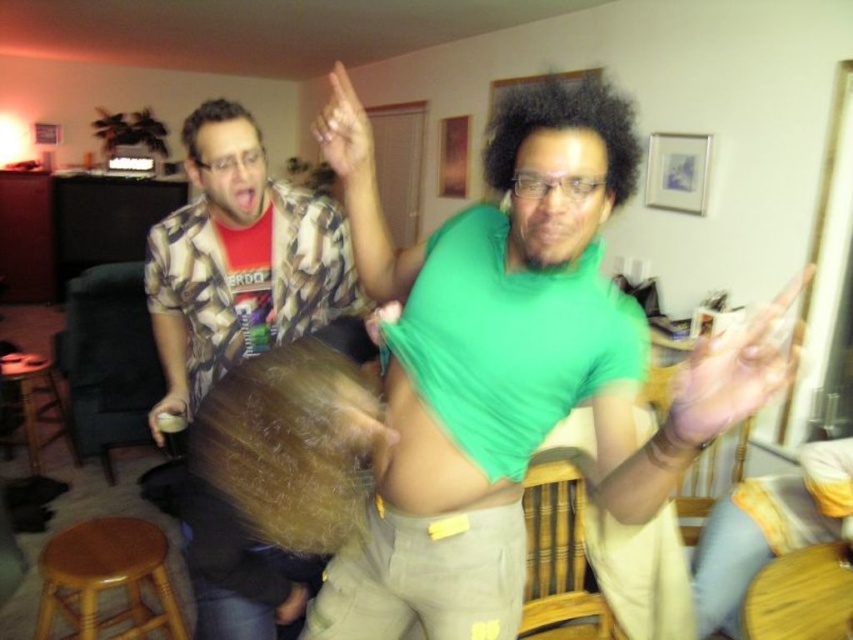
Does green matte shirt at center lie in front of wooden bar stool at lower left?

Yes, green matte shirt at center is in front of wooden bar stool at lower left.

Can you confirm if green matte shirt at center is thinner than wooden bar stool at lower left?

Correct, green matte shirt at center's width is less than wooden bar stool at lower left's.

Does point (595, 330) lie in front of point (24, 358)?

That is True.

What are the coordinates of `green matte shirt at center` in the screenshot? It's located at (524, 362).

Does green matte shirt at center appear over printed cotton shirt at upper left?

→ Incorrect, green matte shirt at center is not positioned above printed cotton shirt at upper left.

Looking at this image, which is more to the left, green matte shirt at center or printed cotton shirt at upper left?

From the viewer's perspective, printed cotton shirt at upper left appears more on the left side.

Which is behind, point (669, 433) or point (222, 500)?

Point (222, 500)

At what (x,y) coordinates should I click in order to perform the action: click on green matte shirt at center. Please return your answer as a coordinate pair (x, y). Image resolution: width=853 pixels, height=640 pixels. Looking at the image, I should click on (524, 362).

Is light brown wooden stool at lower left taller than matte plastic cup at lower left?

Correct, light brown wooden stool at lower left is much taller as matte plastic cup at lower left.

Based on the photo, between light brown wooden stool at lower left and matte plastic cup at lower left, which one is positioned higher?

matte plastic cup at lower left

Is point (68, 596) positioned before point (181, 424)?

That is False.

At what (x,y) coordinates should I click in order to perform the action: click on light brown wooden stool at lower left. Please return your answer as a coordinate pair (x, y). The width and height of the screenshot is (853, 640). Looking at the image, I should click on (107, 579).